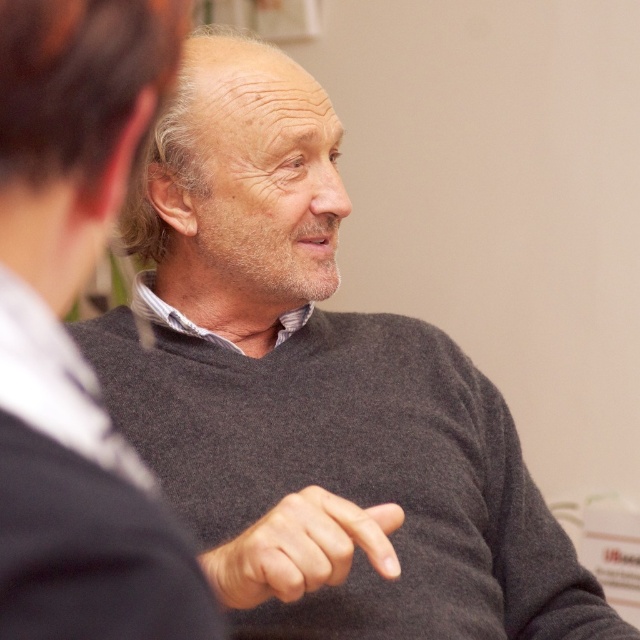
You are a photographer trying to capture a closeup of the dark gray sweater at center and the smooth gray finger at center in the scene. Which object should you zoom in on to ensure it fills the frame without cropping?

The smooth gray finger at center should be zoomed in on because it is larger than the dark gray sweater at center, allowing it to fill the frame without cropping.

Looking at this image, you are a photographer trying to capture a candid shot of the two people in the scene. You want to ensure that both the dark gray sweater at center and the smooth gray finger at center are clearly visible in the frame. Given their relative sizes, which object should you focus on first to ensure proper focus and composition?

The dark gray sweater at center is much taller than the smooth gray finger at center, so you should focus on the dark gray sweater at center first to ensure proper focus and composition.